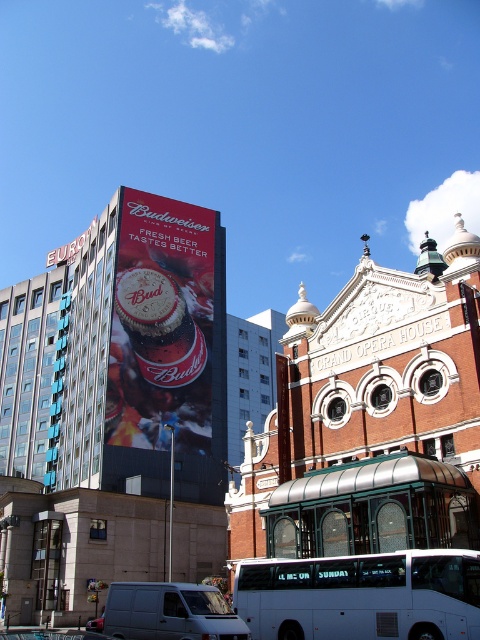
You are a delivery person who needs to place a matte red beer can at upper center onto the metallic silver van at lower left. Can you safely place it there without moving the van?

The matte red beer can at upper center is positioned over the metallic silver van at lower left, so yes, you can safely place it there without moving the van.

You are a photographer standing in the middle of the street facing the modern high rise building with the Budweiser advertisement and the historic Grand Opera House. You want to take a close up photo of the matte red beer can at upper center. Considering your current position, will you be able to capture the entire beer can in your shot without moving closer? Explain your reasoning based on the distance provided.

The matte red beer can at upper center is 71.86 meters away from the viewer. At this distance, capturing a close up photo without moving closer would be challenging as the beer can may appear too small in the frame to be the main focus. However, using a telephoto lens could help magnify the subject from that distance.

You are a tourist standing in the middle of the street looking at the scene. You see the matte red beer can at upper center and the white matte bus at lower center. Which object is closer to you?

The matte red beer can at upper center is closer to you because it is further to the viewer than the white matte bus at lower center.